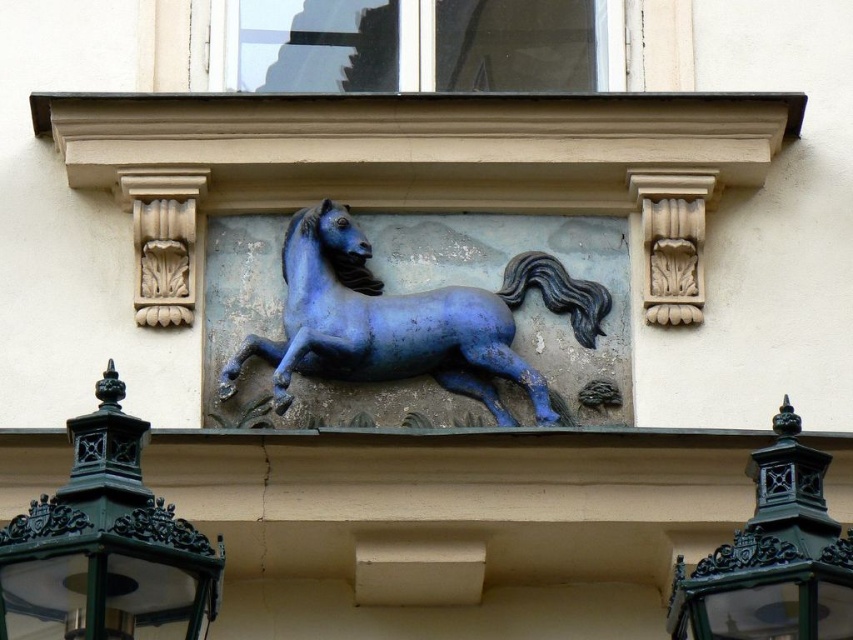
Consider the image. You are standing in front of the building and see both the green cast iron lamp at lower left and the green cast iron lantern at lower right. Which one is located to the left side?

The green cast iron lamp at lower left is positioned on the left side of the green cast iron lantern at lower right, so it is the one located to the left side.

You are an architect analyzing the facade of a building. You have a point at coordinates point (407, 321). What object is located at that point?

The point (407, 321) indicates the glossy blue horse at center.

You are an architect designing a new building facade and want to place a new decorative element. You have a green cast iron lamp at lower left. Where should you place it to match the existing architectural elements?

The green cast iron lamp at lower left should be placed at the coordinates specified by the 2D location point (106, 547) to align with the existing architectural elements.